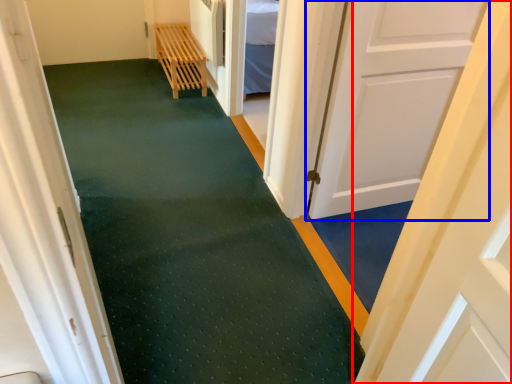
Question: Which of the following is the farthest to the observer, door (highlighted by a red box) or door (highlighted by a blue box)?

Choices:
 (A) door
 (B) door

Answer: (B)